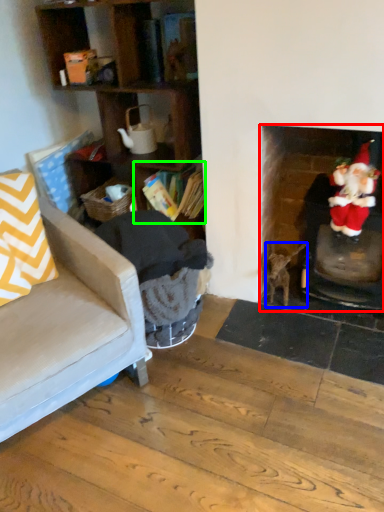
Question: Based on their relative distances, which object is nearer to fireplace (highlighted by a red box)? Choose from animal (highlighted by a blue box) and shelf (highlighted by a green box).

Choices:
 (A) animal
 (B) shelf

Answer: (A)